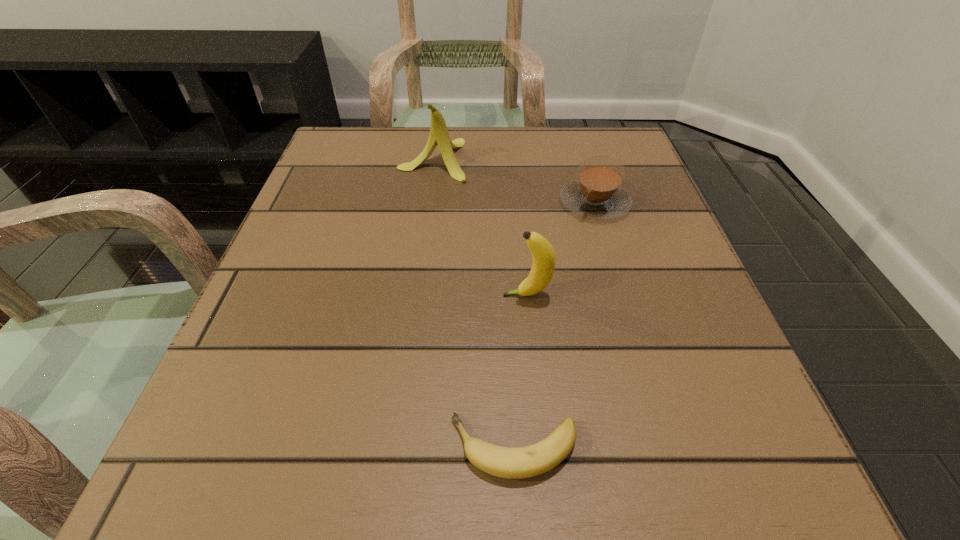
In order to click on free area in between the farthest banana and the nearest banana in this screenshot , I will do `click(473, 303)`.

This screenshot has height=540, width=960. Find the location of `vacant area that lies between the second nearest banana and the cappuccino`. vacant area that lies between the second nearest banana and the cappuccino is located at coordinates (561, 248).

You are a GUI agent. You are given a task and a screenshot of the screen. Output one action in this format:
    pyautogui.click(x=<x>, y=<y>)
    Task: Click on the vacant region between the farthest banana and the cappuccino
    The height and width of the screenshot is (540, 960).
    Given the screenshot: What is the action you would take?
    pyautogui.click(x=514, y=181)

Identify the location of empty space that is in between the farthest banana and the second nearest object. (480, 227).

Image resolution: width=960 pixels, height=540 pixels. I want to click on object that is the second closest one to the rightmost object, so click(x=439, y=135).

The width and height of the screenshot is (960, 540). What are the coordinates of `object that can be found as the closest to the second nearest banana` in the screenshot? It's located at (597, 194).

The height and width of the screenshot is (540, 960). I want to click on banana that can be found as the closest to the second nearest object, so click(x=506, y=462).

Find the location of a particular element. the closest banana to the second nearest banana is located at coordinates (506, 462).

I want to click on free point that satisfies the following two spatial constraints: 1. on the front side of the rightmost object; 2. from the stem of the second farthest banana, so click(x=623, y=295).